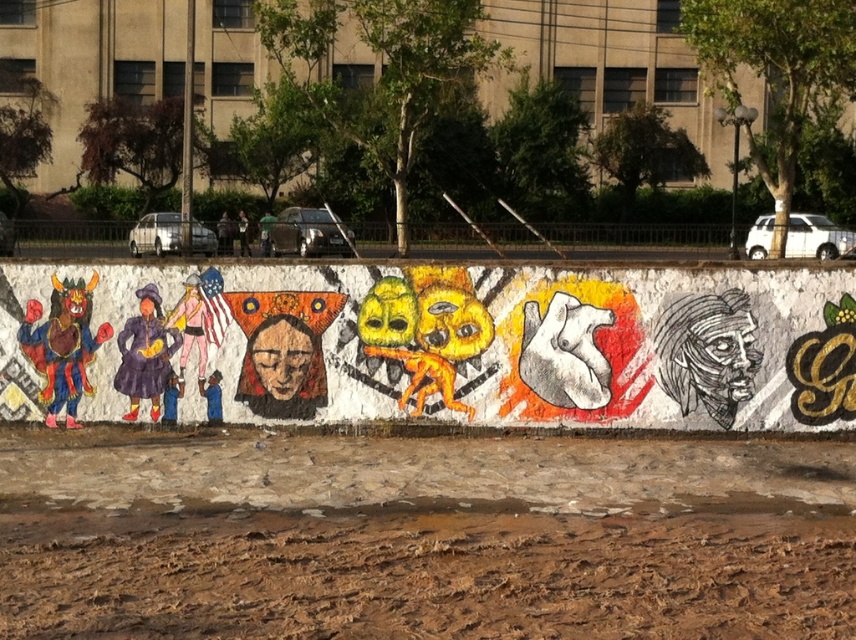
You are standing in front of the beige building and notice the brown textured dirt at lower center and the vibrant painted mural at center. Which object is nearer to you?

The brown textured dirt at lower center is closer to the viewer than the vibrant painted mural at center.

You are a painter standing at the base of the beige building. You want to place a new painting that is wider than the brown textured dirt at lower center. Will the vibrant painted mural at center fit in its current position if you move it to make space?

The brown textured dirt at lower center is wider than the vibrant painted mural at center. Moving the mural might allow space for the new painting, but the mural itself is narrower and could fit in another spot.